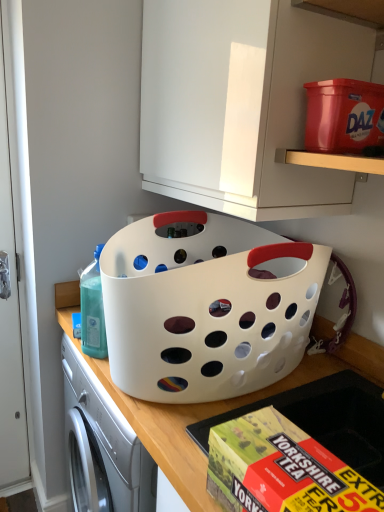
Question: Is white glossy cabinet at upper center situated inside translucent plastic bottle at left or outside?

Choices:
 (A) inside
 (B) outside

Answer: (B)

Question: Based on their positions, is white glossy cabinet at upper center located to the left or right of translucent plastic bottle at left?

Choices:
 (A) right
 (B) left

Answer: (A)

Question: Estimate the real-world distances between objects in this image. Which object is farther from the matte plastic storage box at upper right?

Choices:
 (A) white plastic basket at center
 (B) white glossy cabinet at upper center
 (C) yellow cardboard box at lower center
 (D) white plastic basket at center
 (E) translucent plastic bottle at left

Answer: (E)

Question: Estimate the real-world distances between objects in this image. Which object is farther from the white plastic basket at center?

Choices:
 (A) white glossy cabinet at upper center
 (B) matte plastic storage box at upper right
 (C) white plastic basket at center
 (D) yellow cardboard box at lower center
 (E) translucent plastic bottle at left

Answer: (B)